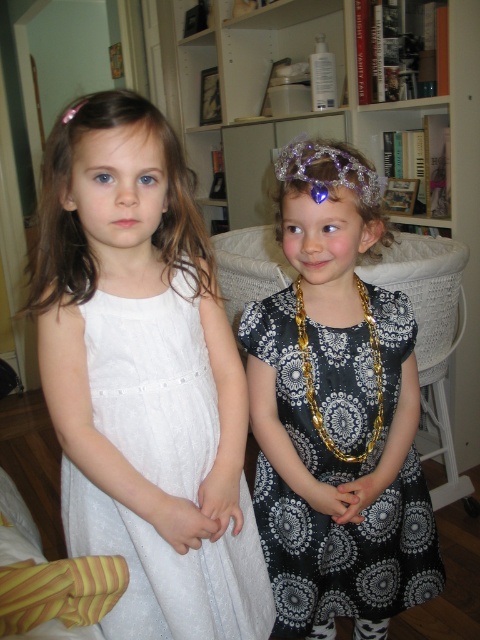
You are a photographer trying to capture a closeup of the silver glitter tiara at upper center without the gold chain necklace at center appearing in the shot. Is this possible given their positions?

The gold chain necklace at center is positioned under the silver glitter tiara at upper center, so if you angle the camera upwards to focus on the tiara, the necklace might still be visible. Alternatively, moving the camera position slightly to the side could help avoid the necklace while capturing the tiara.

You are trying to locate the white lace dress at left in the image. According to the coordinates provided, where exactly is it positioned?

The white lace dress at left is located at point 0.600 on the x axis and 0.323 on the y axis.

You are a photographer setting up for a photoshoot and need to position a light source to the left of the gold chain necklace at center. Which object should you place the light to the left of, and will it be to the left of the black satin dress at center?

The light should be placed to the left of the gold chain necklace at center. Since the black satin dress at center is to the right of the gold chain necklace at center, the light will indeed be to the left of the black satin dress at center.